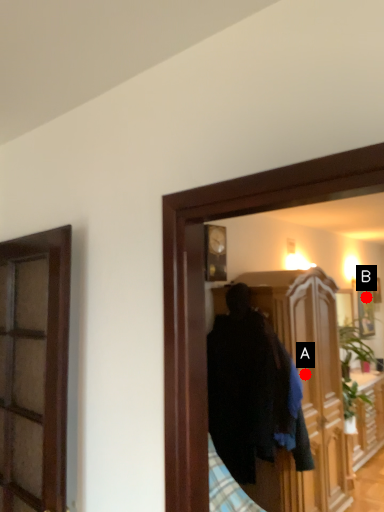
Question: Two points are circled on the image, labeled by A and B beside each circle. Which of the following is the farthest from the observer?

Choices:
 (A) A is further
 (B) B is further

Answer: (B)